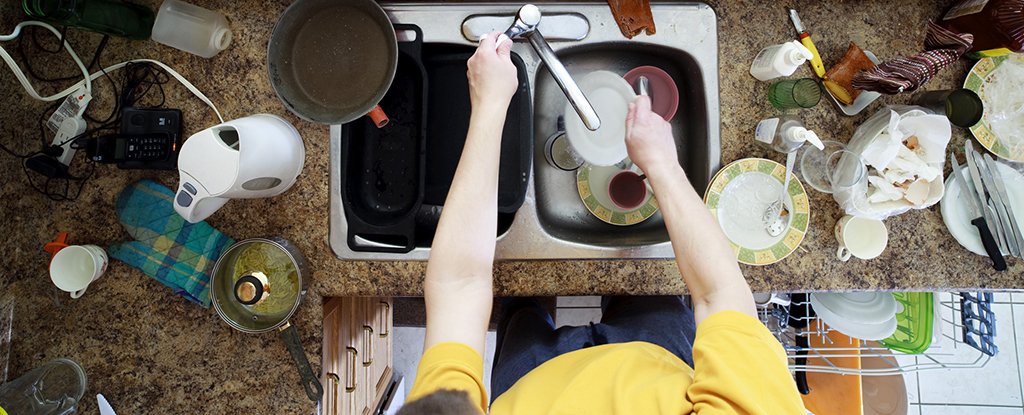
Identify the location of open dishwasher / racks / plates. [870, 367].